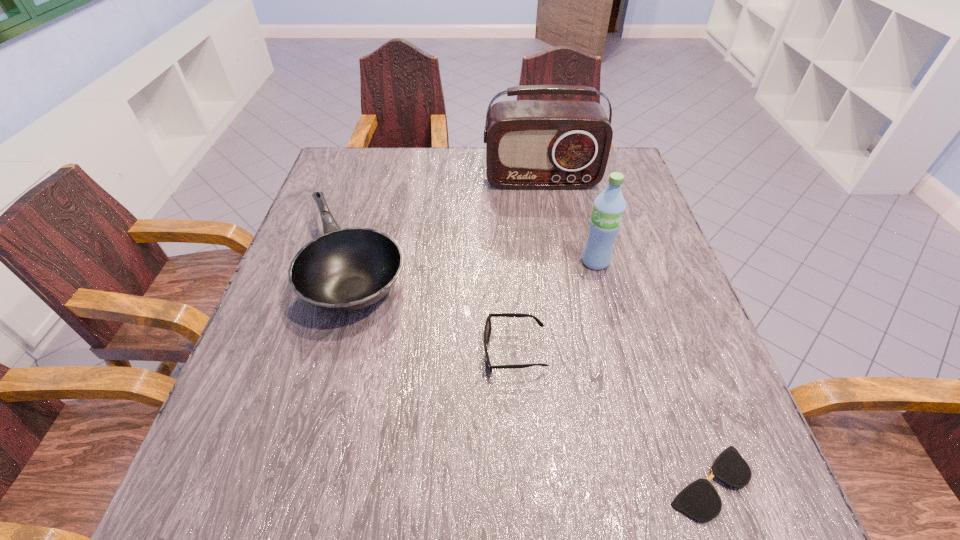
This screenshot has height=540, width=960. Identify the location of vacant space located 0.230m on the front-facing side of the sunglasses. (367, 351).

Locate an element on the screen. Image resolution: width=960 pixels, height=540 pixels. vacant space located on the front-facing side of the sunglasses is located at coordinates (285, 351).

You are a GUI agent. You are given a task and a screenshot of the screen. Output one action in this format:
    pyautogui.click(x=<x>, y=<y>)
    Task: Click on the free space located on the front-facing side of the sunglasses
    The height and width of the screenshot is (540, 960).
    Given the screenshot: What is the action you would take?
    (458, 351)

Find the location of `vacant space situated 0.300m on the left of the spectacles`. vacant space situated 0.300m on the left of the spectacles is located at coordinates coord(474,483).

At what (x,y) coordinates should I click in order to perform the action: click on object positioned at the far edge. Please return your answer as a coordinate pair (x, y). Image resolution: width=960 pixels, height=540 pixels. Looking at the image, I should click on (530, 144).

Find the location of a particular element. object at the near edge is located at coordinates (699, 500).

Where is `object situated at the left edge`? This screenshot has width=960, height=540. object situated at the left edge is located at coordinates (344, 270).

Locate an element on the screen. The image size is (960, 540). radio receiver located at the right edge is located at coordinates (530, 144).

You are a GUI agent. You are given a task and a screenshot of the screen. Output one action in this format:
    pyautogui.click(x=<x>, y=<y>)
    Task: Click on the water bottle that is at the right edge
    
    Given the screenshot: What is the action you would take?
    coord(609,206)

This screenshot has height=540, width=960. I want to click on spectacles situated at the right edge, so click(x=699, y=500).